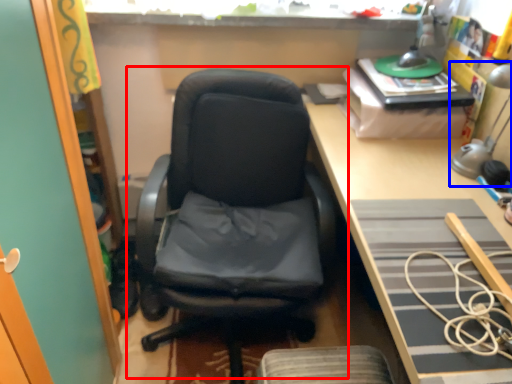
Question: Which of the following is the closest to the observer, chair (highlighted by a red box) or table lamp (highlighted by a blue box)?

Choices:
 (A) chair
 (B) table lamp

Answer: (A)